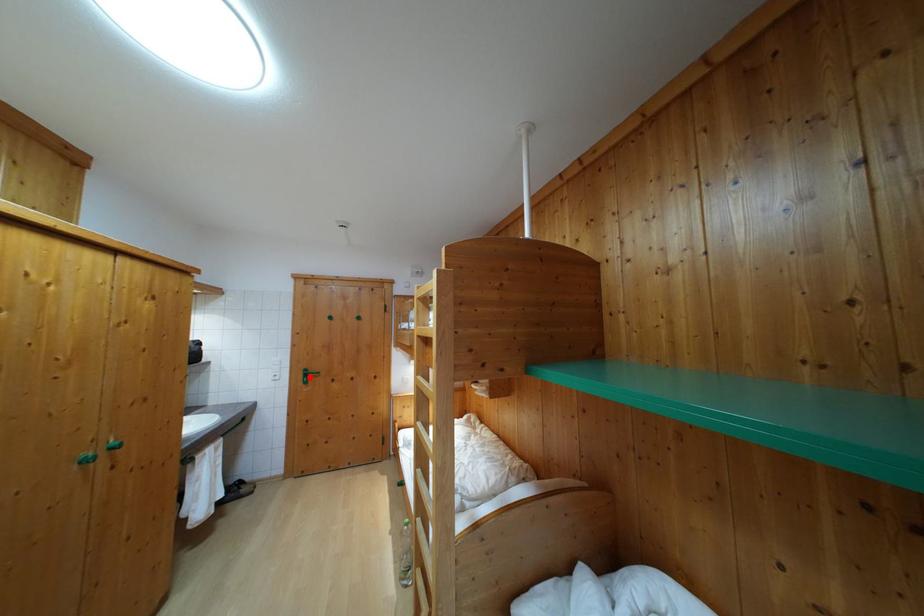
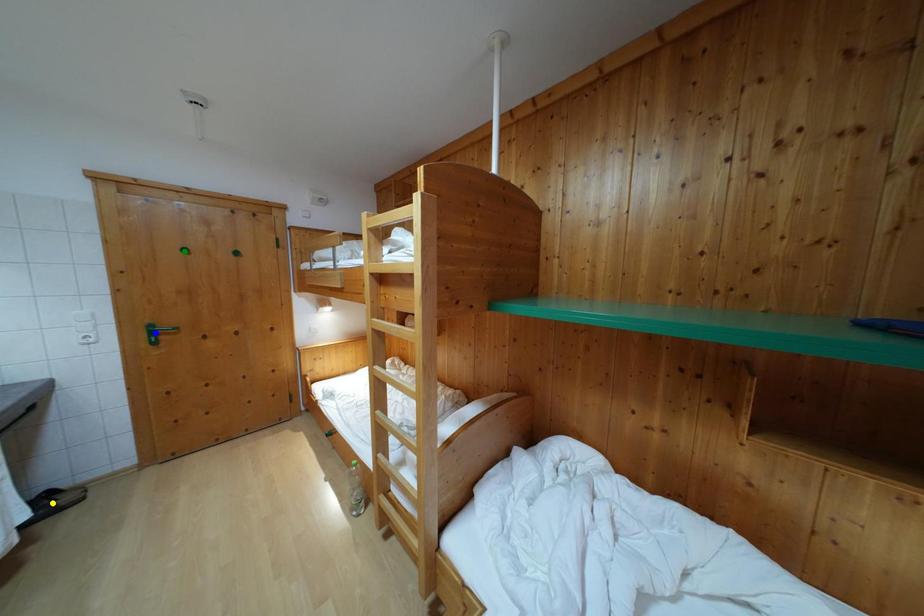
Question: I am providing you with two images of the same scene from different viewpoints. A red point is marked on the first image. You are given multiple points on the second image. Which spot in image 2 lines up with the point in image 1?

Choices:
 (A) blue point
 (B) yellow point
 (C) green point

Answer: (A)